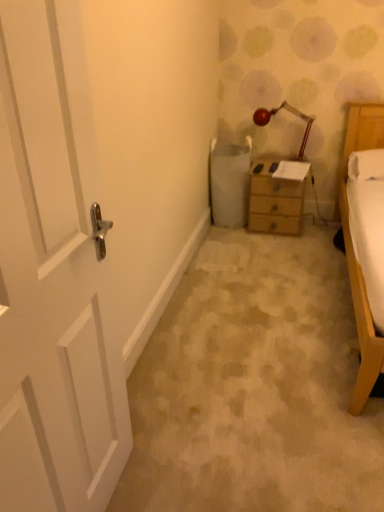
Question: Is white wooden door at left outside matte red lamp at upper right?

Choices:
 (A) yes
 (B) no

Answer: (A)

Question: Is white wooden door at left thinner than matte red lamp at upper right?

Choices:
 (A) yes
 (B) no

Answer: (A)

Question: Is the depth of white wooden door at left greater than that of matte red lamp at upper right?

Choices:
 (A) yes
 (B) no

Answer: (B)

Question: Does white wooden door at left touch matte red lamp at upper right?

Choices:
 (A) yes
 (B) no

Answer: (B)

Question: Does white wooden door at left have a greater width compared to matte red lamp at upper right?

Choices:
 (A) no
 (B) yes

Answer: (A)

Question: From the image's perspective, is white soft pillow at right located above or below matte red lamp at upper right?

Choices:
 (A) below
 (B) above

Answer: (A)

Question: In the image, is white soft pillow at right on the left side or the right side of matte red lamp at upper right?

Choices:
 (A) right
 (B) left

Answer: (A)

Question: In terms of height, does white soft pillow at right look taller or shorter compared to matte red lamp at upper right?

Choices:
 (A) tall
 (B) short

Answer: (B)

Question: Is white soft pillow at right wider or thinner than matte red lamp at upper right?

Choices:
 (A) wide
 (B) thin

Answer: (A)

Question: Is wooden nightstand at center situated inside white wooden door at left or outside?

Choices:
 (A) outside
 (B) inside

Answer: (A)

Question: Is wooden nightstand at center wider or thinner than white wooden door at left?

Choices:
 (A) wide
 (B) thin

Answer: (A)

Question: From a real-world perspective, is wooden nightstand at center physically located above or below white wooden door at left?

Choices:
 (A) below
 (B) above

Answer: (A)

Question: Is wooden nightstand at center in front of or behind white wooden door at left in the image?

Choices:
 (A) behind
 (B) front

Answer: (A)

Question: Is white soft pillow at right inside the boundaries of wooden nightstand at center, or outside?

Choices:
 (A) inside
 (B) outside

Answer: (B)

Question: Considering the positions of point (374, 167) and point (253, 217), is point (374, 167) closer or farther from the camera than point (253, 217)?

Choices:
 (A) farther
 (B) closer

Answer: (B)